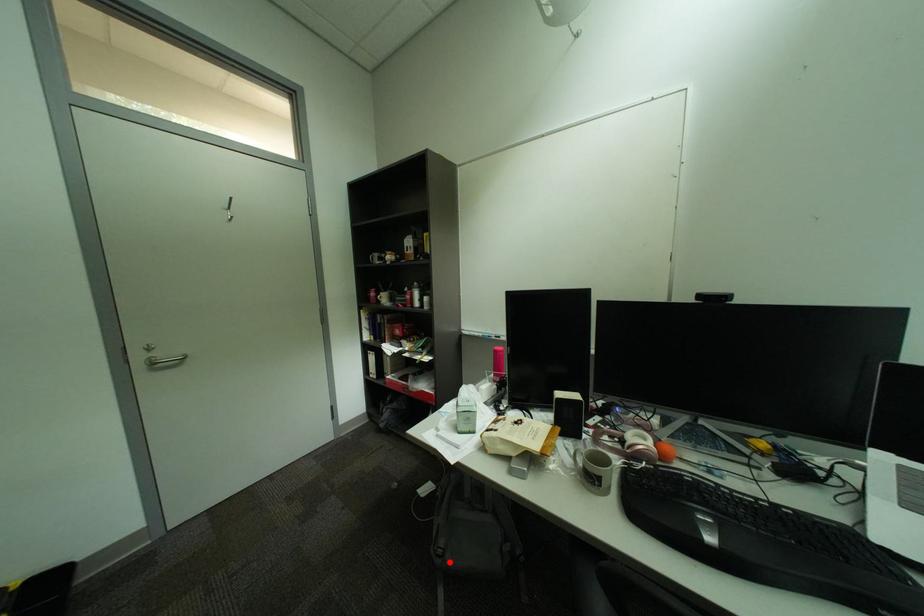
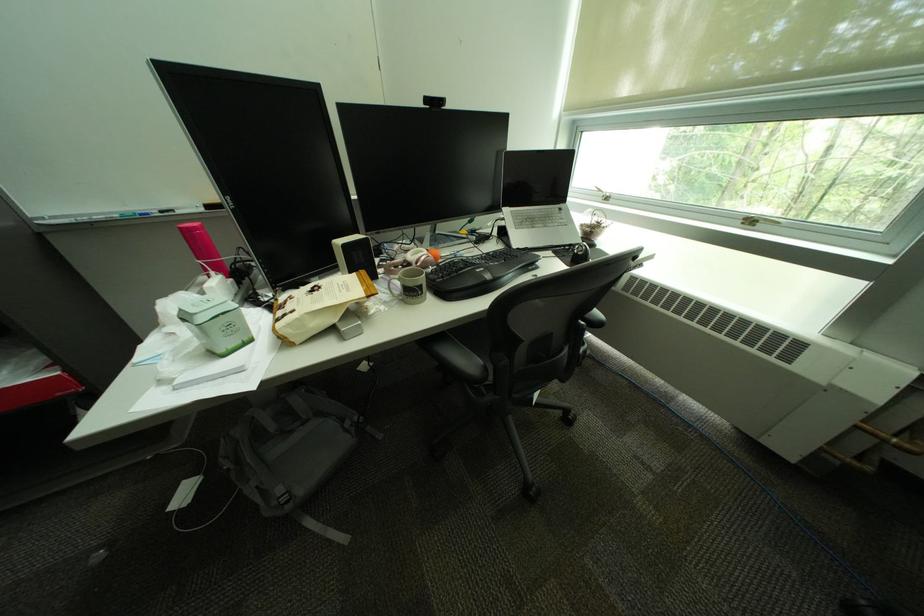
The point at the highlighted location is marked in the first image. Where is the corresponding point in the second image?

(299, 508)